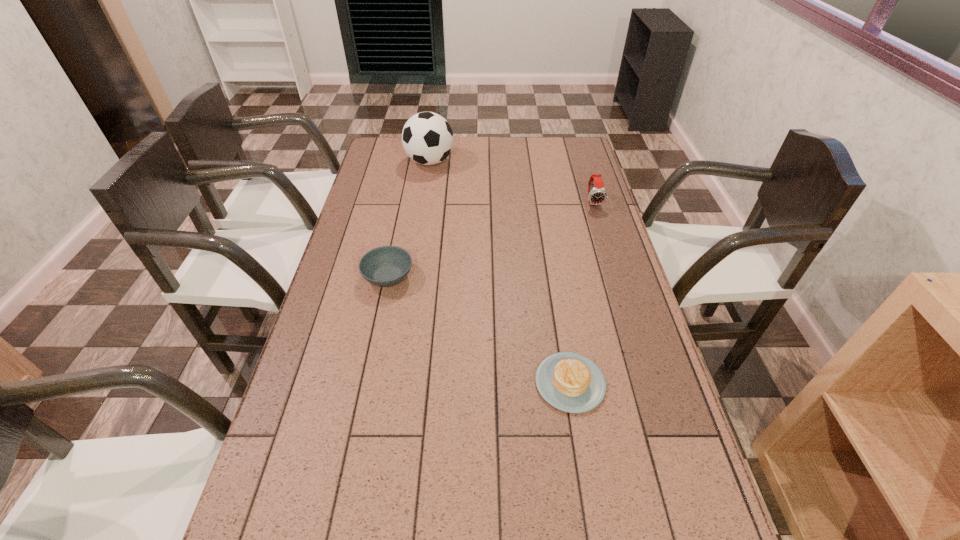
The image size is (960, 540). I want to click on vacant space at the right edge, so click(613, 256).

Where is `vacant space at the far left corner of the desktop`? This screenshot has height=540, width=960. vacant space at the far left corner of the desktop is located at coordinates (374, 150).

Identify the location of free spot between the third farthest object and the third object from left to right. The image size is (960, 540). (479, 330).

Locate an element on the screen. The image size is (960, 540). free spot between the soccer ball and the rightmost object is located at coordinates 512,182.

The height and width of the screenshot is (540, 960). Identify the location of vacant space that's between the second nearest object and the tallest object. (409, 219).

Identify the location of blank region between the third nearest object and the third object from left to right. (582, 292).

Locate an element on the screen. The height and width of the screenshot is (540, 960). free space between the shortest object and the rightmost object is located at coordinates (582, 292).

This screenshot has height=540, width=960. I want to click on free area in between the third shortest object and the soup bowl, so click(491, 239).

Find the location of a particular element. The width and height of the screenshot is (960, 540). free point between the second farthest object and the tallest object is located at coordinates (512, 182).

Locate an element on the screen. This screenshot has height=540, width=960. vacant region between the rightmost object and the soup bowl is located at coordinates (491, 239).